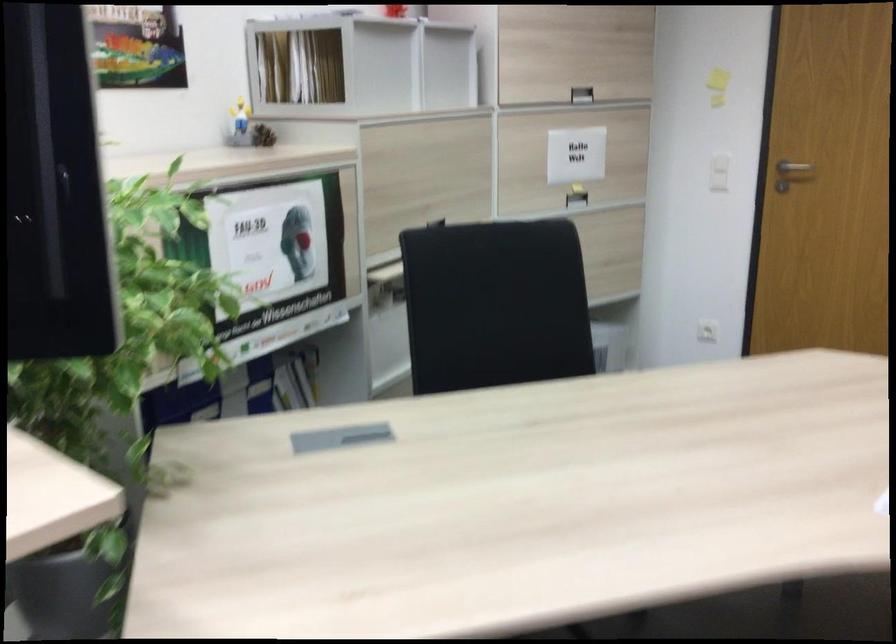
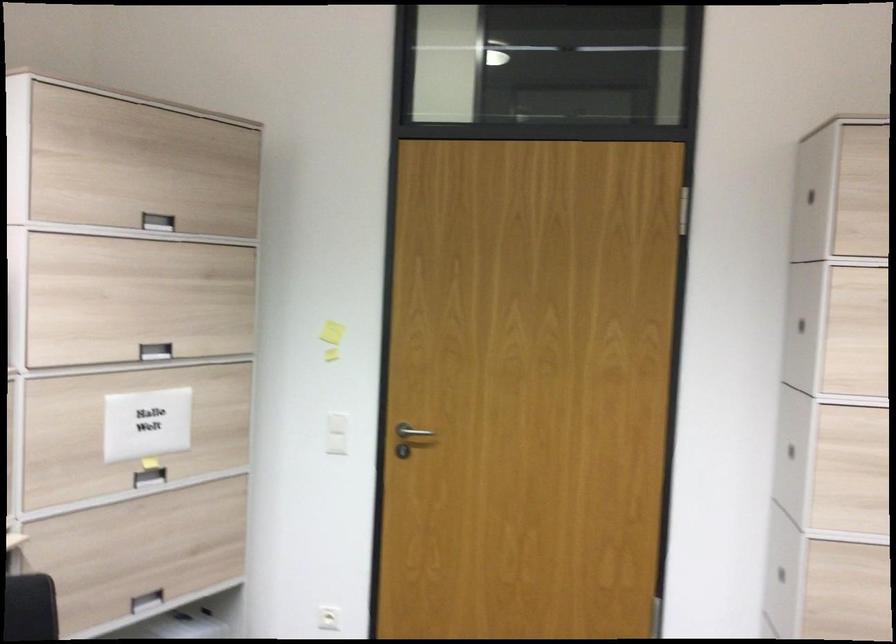
Question: How did the camera likely rotate?

Choices:
 (A) Left
 (B) Right
 (C) Up
 (D) Down

Answer: (B)